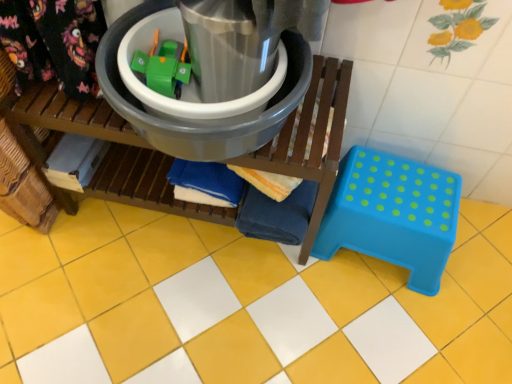
I want to click on free space in front of blue plastic step stool at lower right, so click(x=379, y=331).